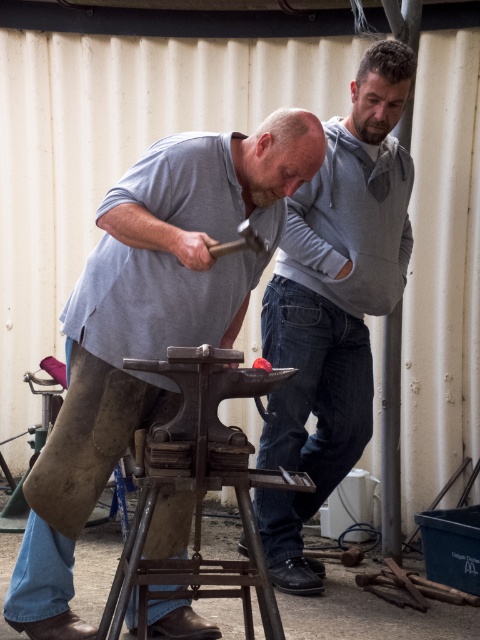
Is point (50, 465) farther from viewer compared to point (317, 212)?

No, (50, 465) is in front of (317, 212).

Does matte gray shirt at center have a smaller size compared to gray cotton shirt at upper center?

No.

Between point (78, 625) and point (395, 184), which one is positioned behind?

The point (395, 184) is behind.

Find the location of a particular element. The width and height of the screenshot is (480, 640). matte gray shirt at center is located at coordinates (148, 324).